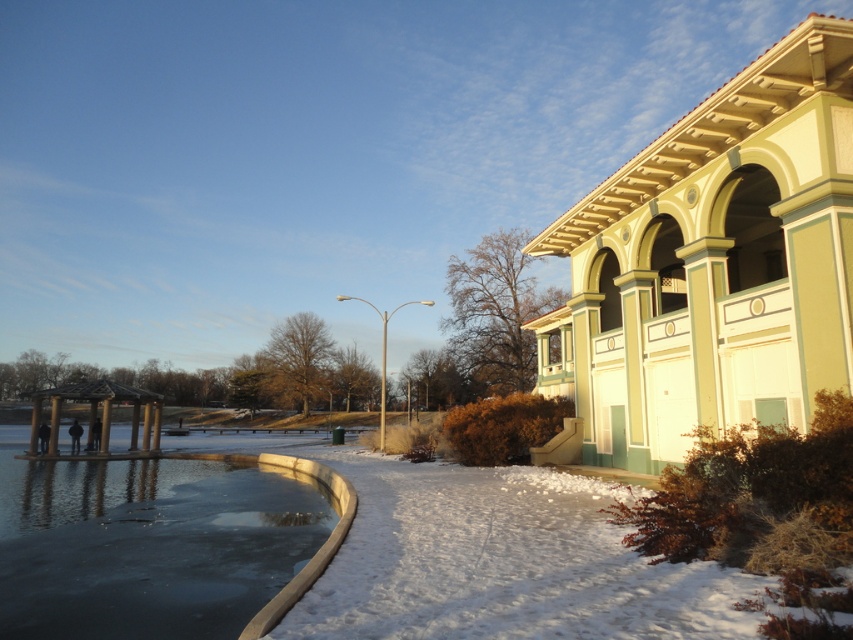
Question: Which of the following is the farthest from the observer?

Choices:
 (A) white fluffy snow at lower center
 (B) smooth concrete lake at lower left

Answer: (B)

Question: Which of the following is the closest to the observer?

Choices:
 (A) white fluffy snow at lower center
 (B) smooth concrete lake at lower left

Answer: (A)

Question: Considering the relative positions of white fluffy snow at lower center and smooth concrete lake at lower left in the image provided, where is white fluffy snow at lower center located with respect to smooth concrete lake at lower left?

Choices:
 (A) left
 (B) right

Answer: (B)

Question: Does white fluffy snow at lower center have a smaller size compared to smooth concrete lake at lower left?

Choices:
 (A) no
 (B) yes

Answer: (B)

Question: Is white fluffy snow at lower center behind smooth concrete lake at lower left?

Choices:
 (A) no
 (B) yes

Answer: (A)